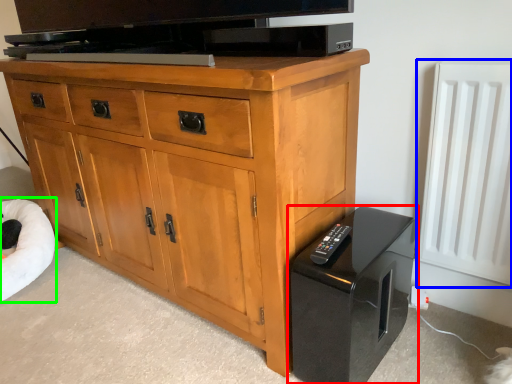
Question: Considering the real-world distances, which object is closest to home appliance (highlighted by a red box)? radiator (highlighted by a blue box) or bean bag chair (highlighted by a green box).

Choices:
 (A) radiator
 (B) bean bag chair

Answer: (A)